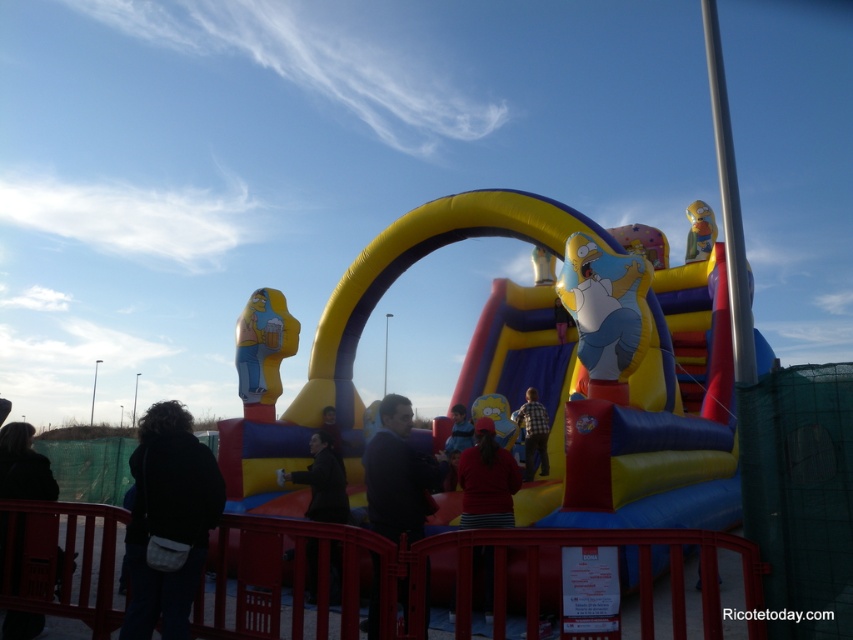
Question: Estimate the real-world distances between objects in this image. Which object is farther from the yellow matte homer simpson at left?

Choices:
 (A) yellow rubber homer simpson at upper center
 (B) dark blue sweater at center
 (C) matte blue shirt at center
 (D) matte red shirt at center

Answer: (A)

Question: Can you confirm if matte red shirt at center is positioned to the left of dark brown leather jacket at center?

Choices:
 (A) no
 (B) yes

Answer: (A)

Question: Among these points, which one is farthest from the camera?

Choices:
 (A) (527, 449)
 (B) (3, 436)
 (C) (496, 500)
 (D) (137, 634)

Answer: (A)

Question: Which point is closer to the camera?

Choices:
 (A) (131, 564)
 (B) (462, 442)
 (C) (694, 237)

Answer: (A)

Question: Is the position of black fabric jacket at lower left more distant than that of yellow rubber homer simpson at upper center?

Choices:
 (A) no
 (B) yes

Answer: (A)

Question: Is dark brown leather jacket at lower left smaller than checkered fabric shirt at center?

Choices:
 (A) no
 (B) yes

Answer: (A)